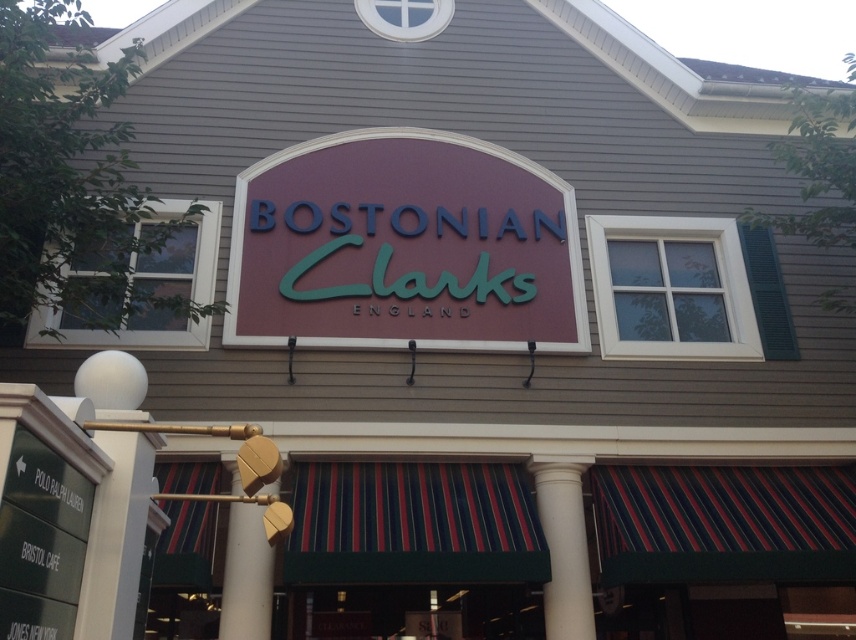
Question: Which point is closer to the camera?

Choices:
 (A) (562, 476)
 (B) (242, 616)

Answer: (B)

Question: Which object appears farthest from the camera in this image?

Choices:
 (A) matte maroon sign at center
 (B) white smooth column at center

Answer: (A)

Question: Among these objects, which one is farthest from the camera?

Choices:
 (A) wooden at center
 (B) matte maroon sign at center

Answer: (B)

Question: Does matte maroon sign at center appear under white smooth column at center?

Choices:
 (A) yes
 (B) no

Answer: (B)

Question: Is matte maroon sign at center below white smooth column at center?

Choices:
 (A) yes
 (B) no

Answer: (B)

Question: Does matte maroon sign at center have a greater width compared to white smooth column at center?

Choices:
 (A) yes
 (B) no

Answer: (A)